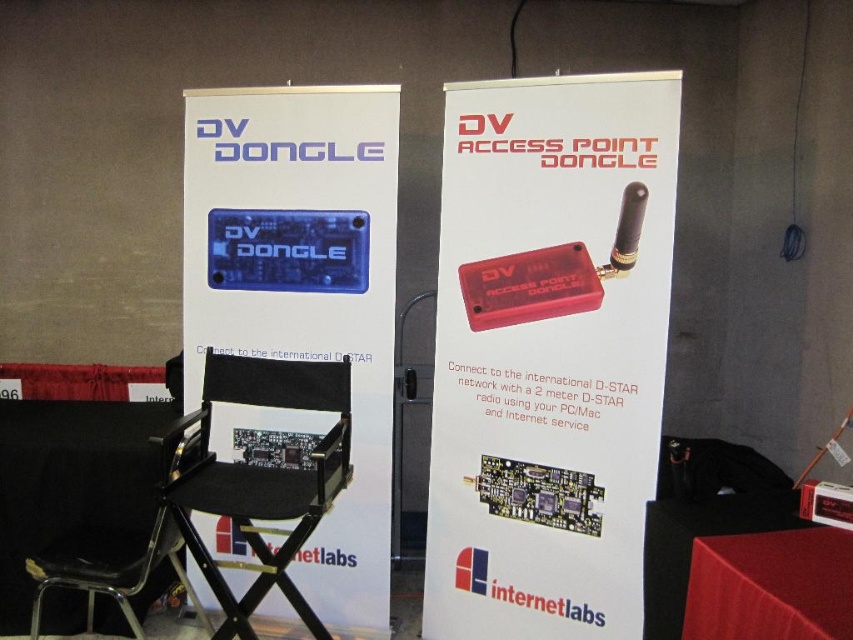
Who is taller, red plastic dongle at center or black fabric chair at center?

red plastic dongle at center

Consider the image. Is red plastic dongle at center thinner than black fabric chair at center?

No.

Which is in front, point (465, 337) or point (218, 508)?

Point (218, 508) is more forward.

At what (x,y) coordinates should I click in order to perform the action: click on red plastic dongle at center. Please return your answer as a coordinate pair (x, y). Looking at the image, I should click on (549, 353).

The width and height of the screenshot is (853, 640). Identify the location of blue plastic dv dongle at center. (303, 289).

Does blue plastic dv dongle at center have a lesser width compared to black fabric chair at center?

Incorrect, blue plastic dv dongle at center's width is not less than black fabric chair at center's.

Which is in front, point (236, 339) or point (346, 384)?

Point (346, 384) is more forward.

The width and height of the screenshot is (853, 640). I want to click on blue plastic dv dongle at center, so click(303, 289).

Who is taller, blue plastic dv dongle at center or black fabric folding chair at center?

blue plastic dv dongle at center

Between blue plastic dv dongle at center and black fabric folding chair at center, which one appears on the left side from the viewer's perspective?

black fabric folding chair at center is more to the left.

Which is in front, point (190, 173) or point (165, 522)?

Positioned in front is point (165, 522).

Image resolution: width=853 pixels, height=640 pixels. What are the coordinates of `blue plastic dv dongle at center` in the screenshot? It's located at (303, 289).